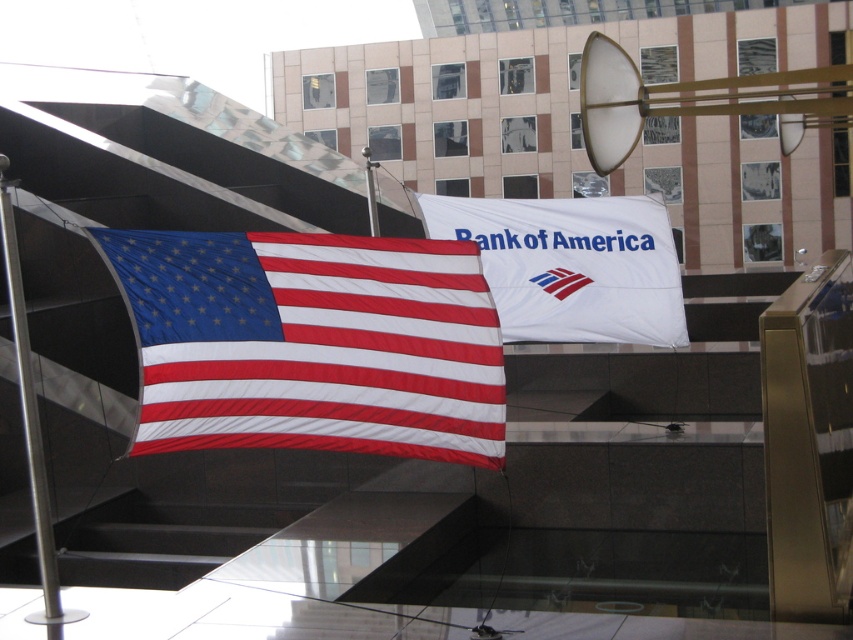
You are standing in the office atrium and want to hang a new decorative banner between the matte fabric flag at center and the silver metallic pole at left. Based on their positions, where should you place the banner?

The matte fabric flag at center is located above the silver metallic pole at left, so you should place the banner between them by positioning it below the matte fabric flag at center and above the silver metallic pole at left.

You are an interior designer planning to place a new decorative item between the white matte flag at center and the silver metallic pole at left. Given their widths, which object should you consider moving closer to the center of the room to maintain balance?

The white matte flag at center is wider than the silver metallic pole at left. To maintain balance, you should move the silver metallic pole at left closer to the center of the room so that their widths visually align.

You are standing in the atrium and want to take a photo of both the matte fabric flag at center and the white matte flag at center. Which flag should you focus on first to ensure both are in clear view?

You should focus on the matte fabric flag at center first since it is closer to you than the white matte flag at center, ensuring both are in clear view by adjusting the camera focus accordingly.